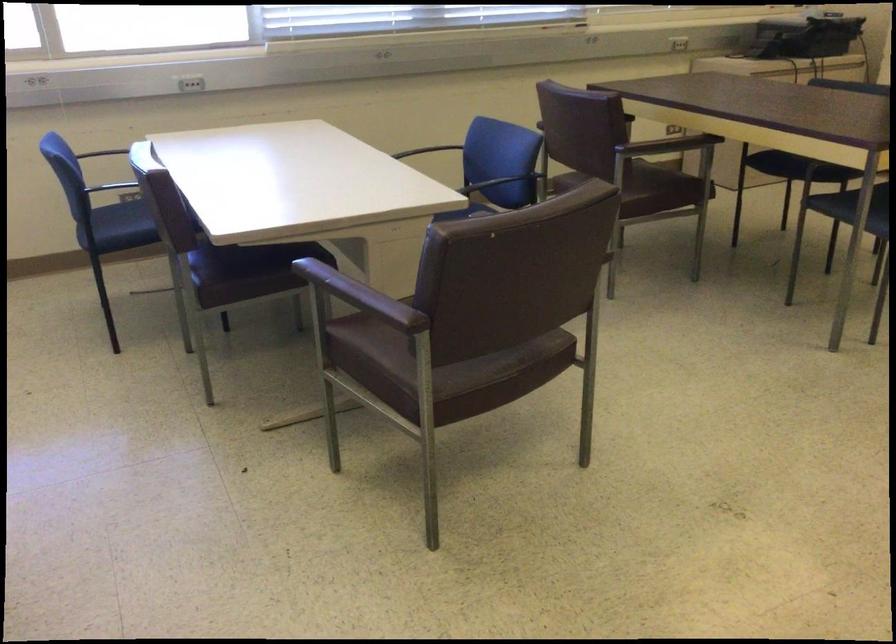
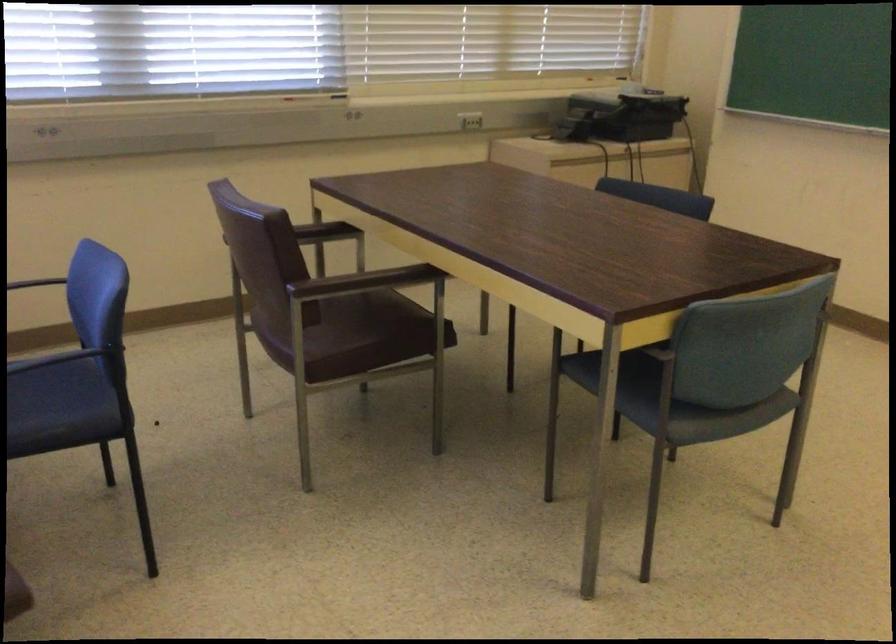
In a continuous first-person perspective shot, in which direction is the camera moving?

The cameraman walked toward right, forward.